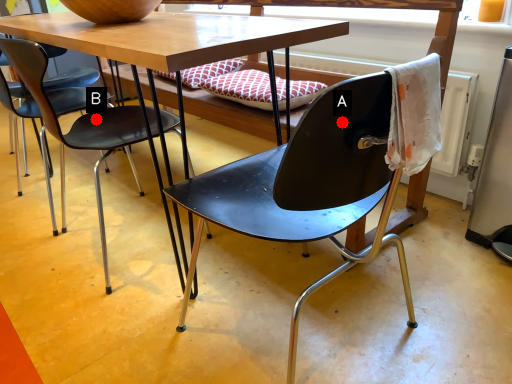
Question: Two points are circled on the image, labeled by A and B beside each circle. Which point appears closest to the camera in this image?

Choices:
 (A) A is closer
 (B) B is closer

Answer: (A)